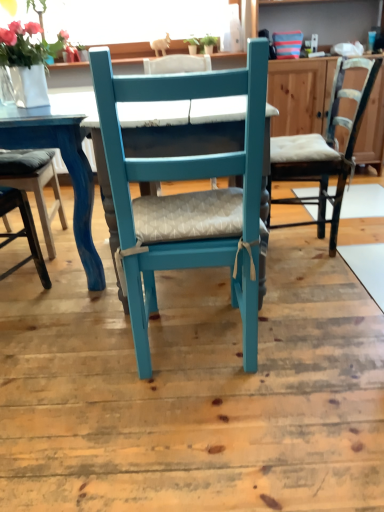
Question: In the image, is matte white cushioned chair at right, the 1th chair when ordered from right to left, positioned in front of or behind matte blue chair at center, which ranks as the 2th table in left-to-right order?

Choices:
 (A) behind
 (B) front

Answer: (A)

Question: Visually, is matte white cushioned chair at right, marked as the 2th chair in a left-to-right arrangement, positioned to the left or to the right of matte blue chair at center, which ranks as the 2th table in left-to-right order?

Choices:
 (A) left
 (B) right

Answer: (B)

Question: Which of these objects is positioned closest to the matte white vase at upper left?

Choices:
 (A) matte blue table at left, the first table viewed from the left
 (B) matte white cushioned chair at right, marked as the 2th chair in a left-to-right arrangement
 (C) matte blue chair at center, the first table when ordered from right to left
 (D) teal painted wood chair at center, the 1th chair from the front

Answer: (C)

Question: Based on their relative distances, which object is farther from the matte blue chair at center, which ranks as the 2th table in left-to-right order?

Choices:
 (A) matte blue table at left, which is the second table from right to left
 (B) matte white cushioned chair at right, the 1th chair when ordered from right to left
 (C) teal painted wood chair at center, which is the second chair from back to front
 (D) matte white vase at upper left

Answer: (B)